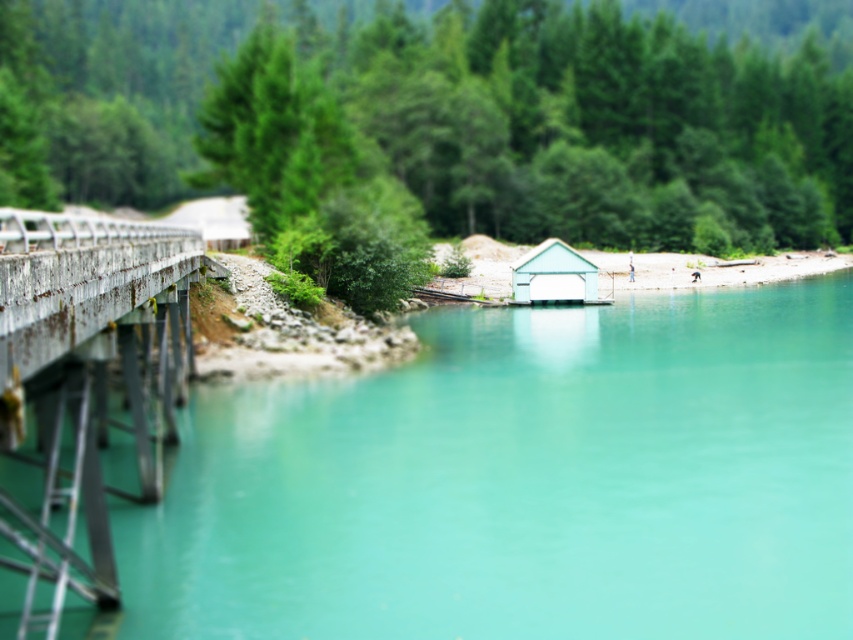
Is rusty metal bridge at left taller than light blue matte hut at center?

Correct, rusty metal bridge at left is much taller as light blue matte hut at center.

Between rusty metal bridge at left and light blue matte hut at center, which one is positioned higher?

light blue matte hut at center is above.

In order to click on rusty metal bridge at left in this screenshot , I will do `click(83, 387)`.

In order to click on rusty metal bridge at left in this screenshot , I will do `click(83, 387)`.

Between teal glossy water at center and light blue matte hut at center, which one is positioned lower?

Positioned lower is teal glossy water at center.

Image resolution: width=853 pixels, height=640 pixels. Identify the location of teal glossy water at center. (520, 483).

The image size is (853, 640). In order to click on teal glossy water at center in this screenshot , I will do `click(520, 483)`.

Can you confirm if teal glossy water at center is thinner than rusty metal bridge at left?

No, teal glossy water at center is not thinner than rusty metal bridge at left.

Who is more forward, (x=335, y=529) or (x=38, y=358)?

Positioned in front is point (x=38, y=358).

Image resolution: width=853 pixels, height=640 pixels. Identify the location of teal glossy water at center. (520, 483).